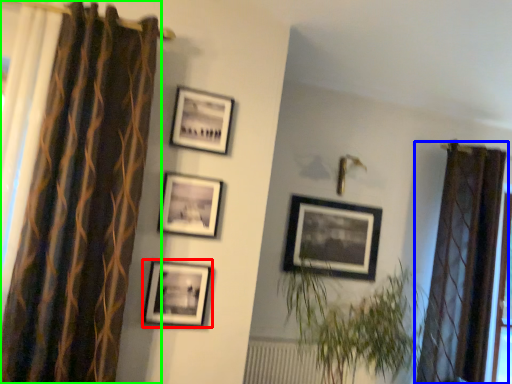
Question: Based on their relative distances, which object is nearer to picture frame (highlighted by a red box)? Choose from curtain (highlighted by a blue box) and curtain (highlighted by a green box).

Choices:
 (A) curtain
 (B) curtain

Answer: (B)